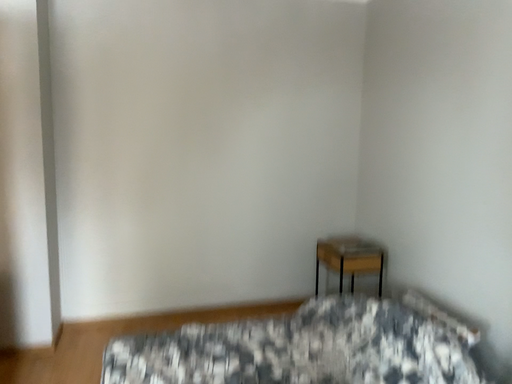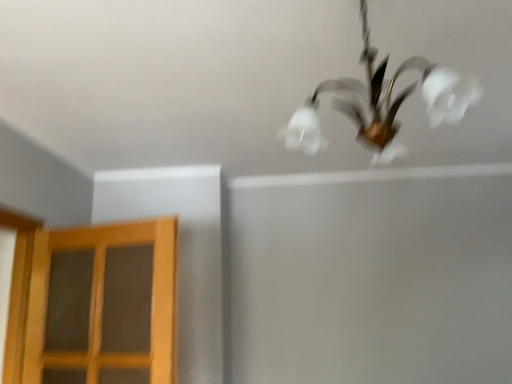
Question: How did the camera likely rotate when shooting the video?

Choices:
 (A) rotated left
 (B) rotated right

Answer: (A)